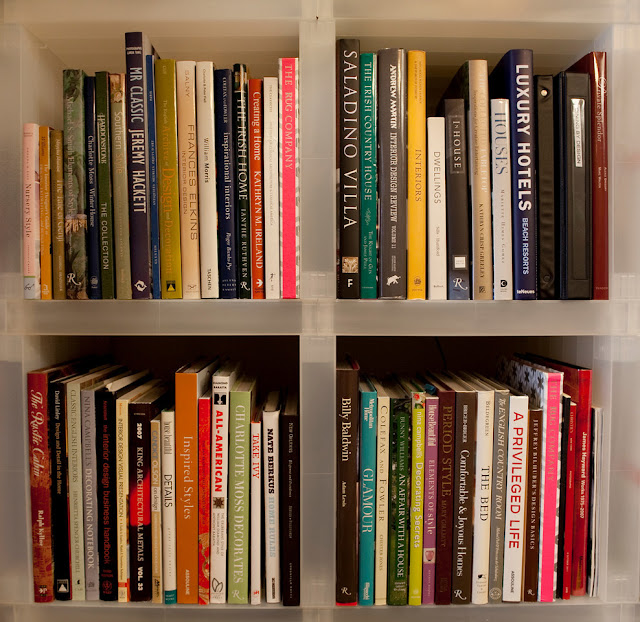
Where is `pink books`? pink books is located at coordinates (32, 237), (282, 218), (556, 506).